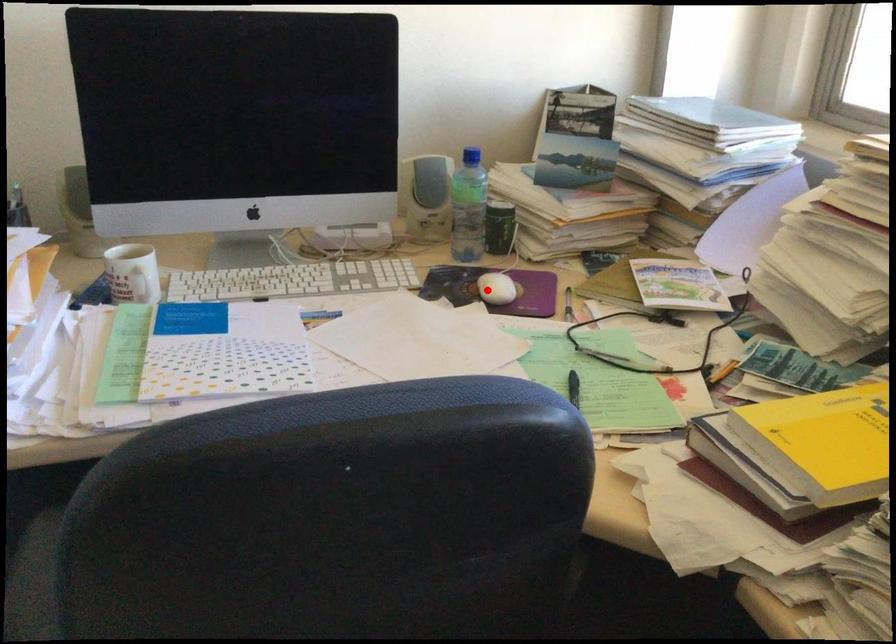
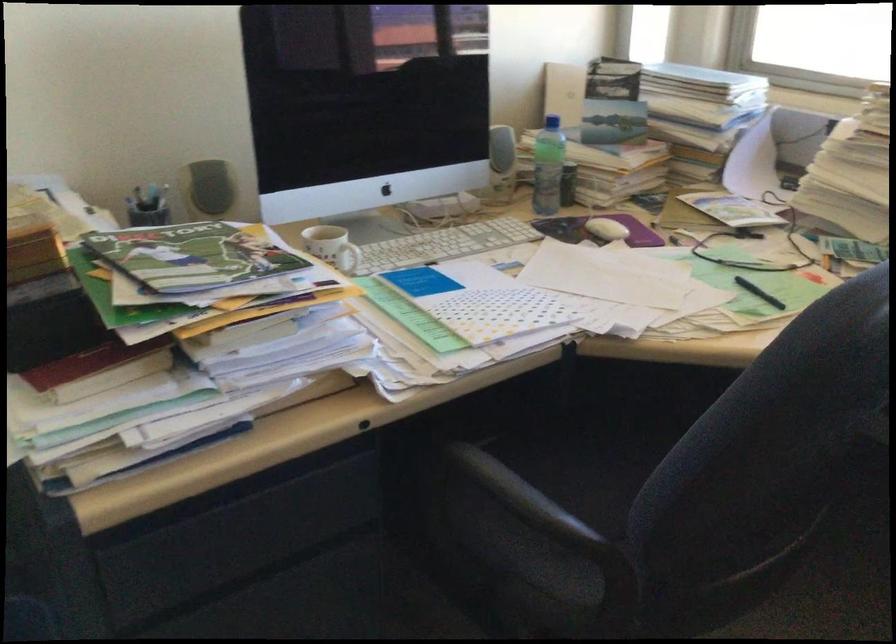
Question: A red point is marked in image1. In image2, is the corresponding 3D point closer to the camera or farther? Reply with the corresponding letter.

Choices:
 (A) The corresponding 3D point is closer.
 (B) The corresponding 3D point is farther.

Answer: (B)